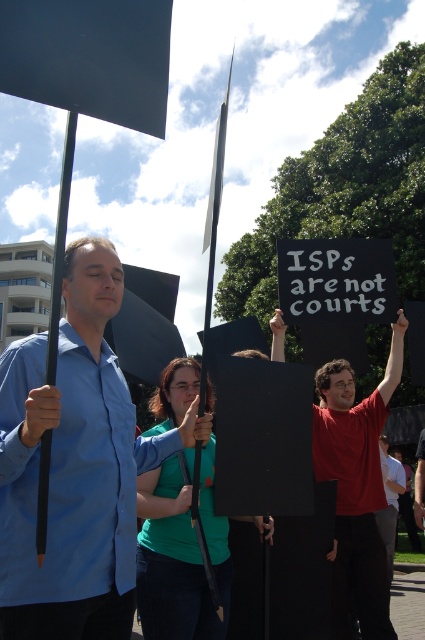
You are a photographer trying to capture a photo of the protest. You notice the blue fabric shirt at center and the matte red shirt at center. Which of these two shirts is positioned higher in the image?

The blue fabric shirt at center is taller than the matte red shirt at center, so the blue fabric shirt at center is positioned higher in the image.

You are standing 10 feet away from the camera. A blue fabric shirt at center is in your line of sight. Can you reach it without moving closer?

The blue fabric shirt at center is 9.53 feet away from the camera, so if you are standing 10 feet away from the camera, you can reach it without moving closer since it is slightly closer than your current position.